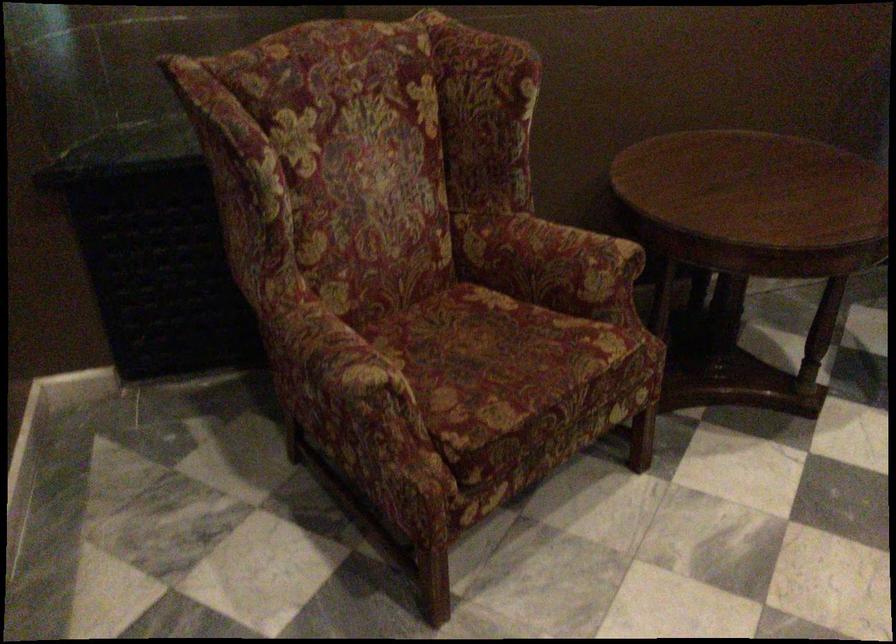
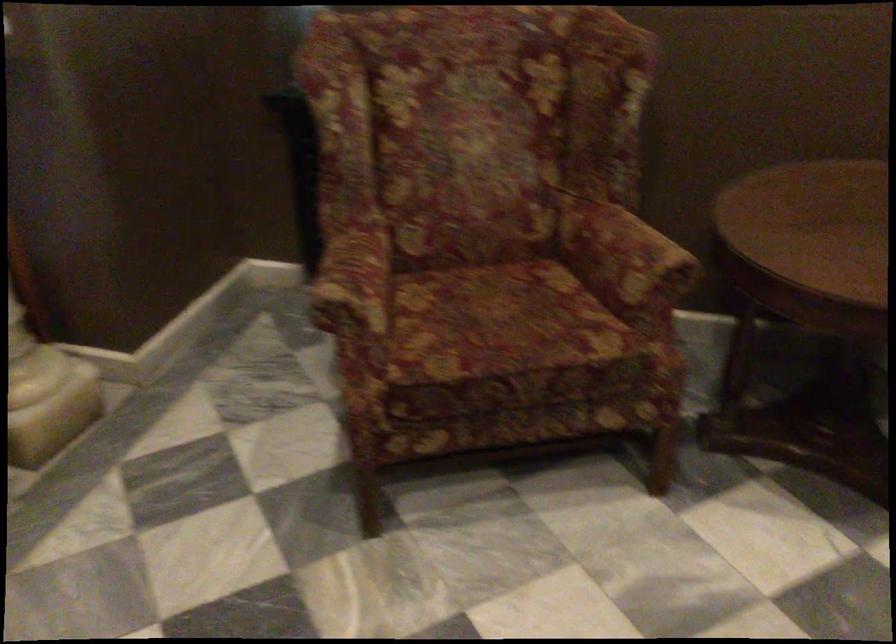
Where in the second image is the point corresponding to [497,357] from the first image?

(501, 323)